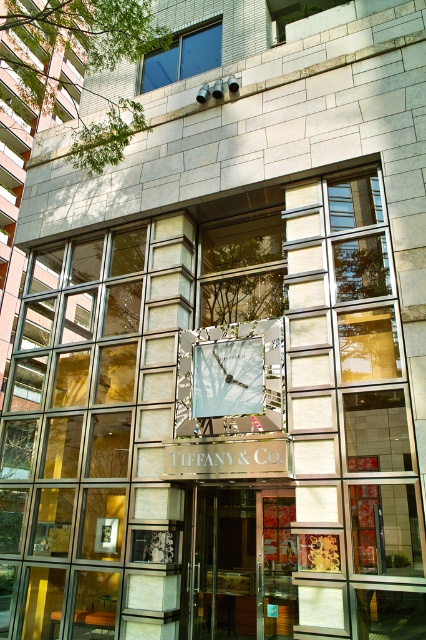
Which of these two, transparent glass door at center or matte silver clock at center, stands taller?

With more height is matte silver clock at center.

Is point (198, 630) more distant than point (258, 348)?

No.

The image size is (426, 640). In order to click on transparent glass door at center in this screenshot , I will do `click(221, 564)`.